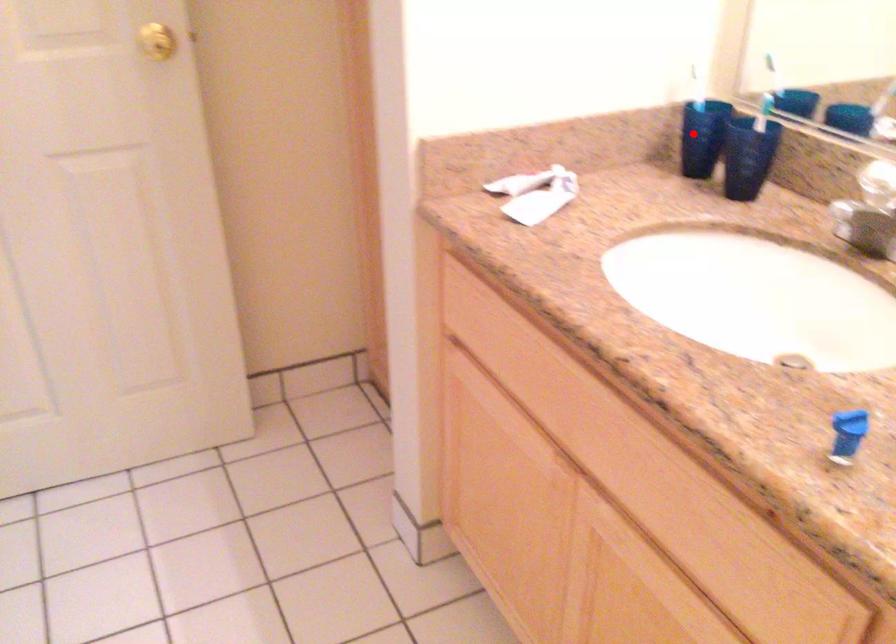
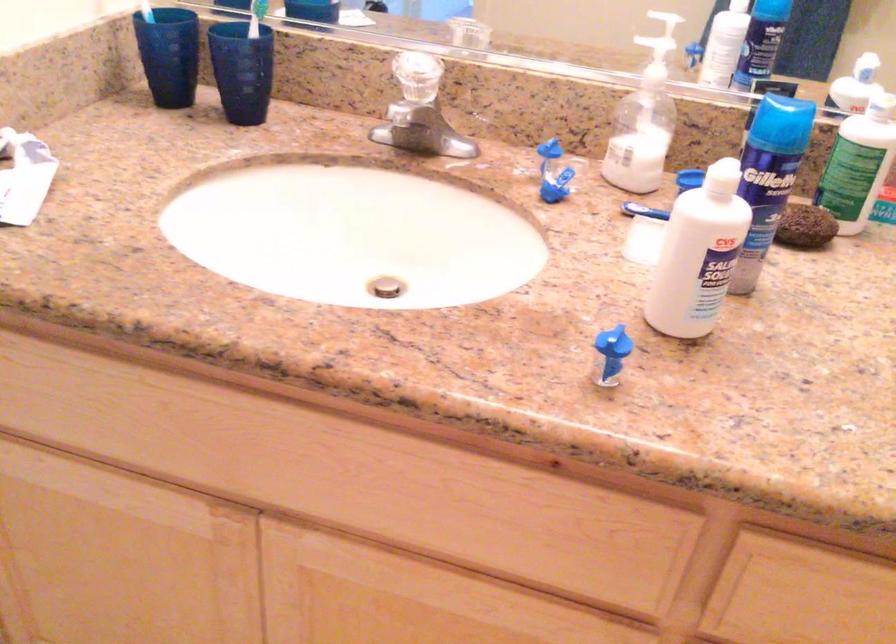
The point at the highlighted location is marked in the first image. Where is the corresponding point in the second image?

(168, 55)